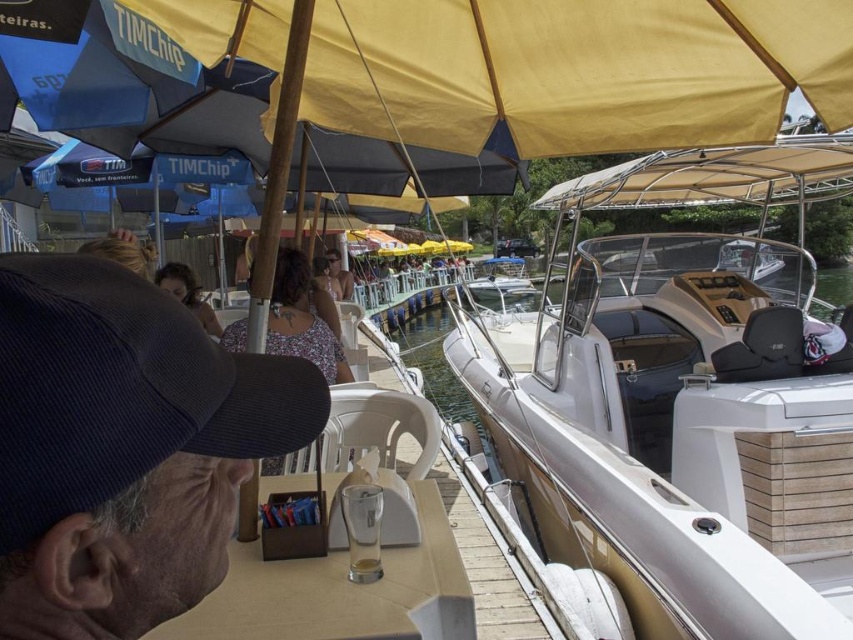
Looking at this image, you are a photographer standing at the edge of the waterfront. You want to take a photo of both the white glossy boat at center and the floral fabric dress at center without any obstruction. Given that your camera has a maximum focus range of 2 meters, will you be able to capture both subjects clearly in the same frame?

The white glossy boat at center is 2.08 meters from the floral fabric dress at center. Since the distance between them exceeds the camera maximum focus range of 2 meters, you cannot capture both subjects clearly in the same frame.

You are a photographer standing at the waterfront scene. You want to take a photo that includes both the white glossy boat at center and the dark blue corduroy baseball cap at upper left. Considering their heights, which object should be placed lower in the frame to ensure both are fully visible?

The dark blue corduroy baseball cap at upper left should be placed lower in the frame because the white glossy boat at center is taller. This way, both objects will fit within the photo without any part being cut off.

Based on the photo, you are standing at the center of the image and want to locate the white glossy boat at center. According to the coordinates provided, in which direction should you look to find it?

The white glossy boat at center is located at coordinates point (682,401). Since you are at the center, looking towards the bottom right direction will help you find it.